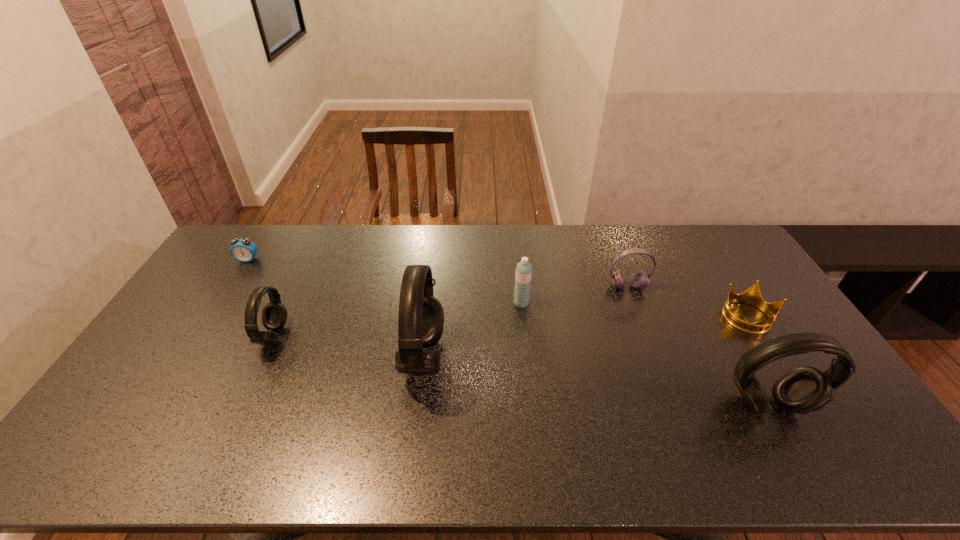
To achieve even spacing by inserting another headset among them, please point to a vacant spot for this new headset. Please provide its 2D coordinates. Your answer should be formatted as a tuple, i.e. [(x, y)], where the tuple contains the x and y coordinates of a point satisfying the conditions above.

[(587, 380)]